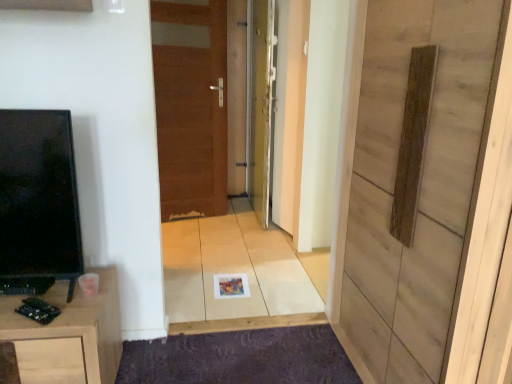
Question: In terms of height, does purple textured mat at lower center look taller or shorter compared to metallic silver door at center, which appears as the second door when viewed from the right?

Choices:
 (A) short
 (B) tall

Answer: (A)

Question: Choose the correct answer: Is purple textured mat at lower center inside metallic silver door at center, which appears as the second door when viewed from the right, or outside it?

Choices:
 (A) outside
 (B) inside

Answer: (A)

Question: Estimate the real-world distances between objects in this image. Which object is farther from the wooden panel at center, which is counted as the third door, starting from the back?

Choices:
 (A) brown wooden door at center, positioned as the 1th door in back-to-front order
 (B) wooden cabinet at lower left
 (C) purple textured mat at lower center
 (D) metallic silver door at center, which is the second door in left-to-right order

Answer: (A)

Question: Which object is the farthest from the brown wooden door at center, positioned as the 1th door in back-to-front order?

Choices:
 (A) purple textured mat at lower center
 (B) wooden panel at center, the first door when ordered from right to left
 (C) wooden cabinet at lower left
 (D) metallic silver door at center, which is the second door in back-to-front order

Answer: (B)